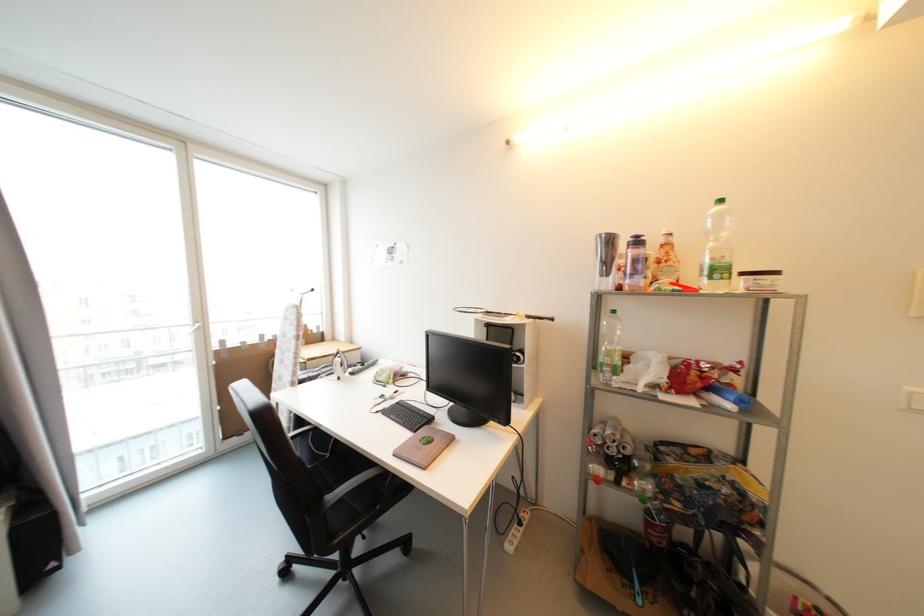
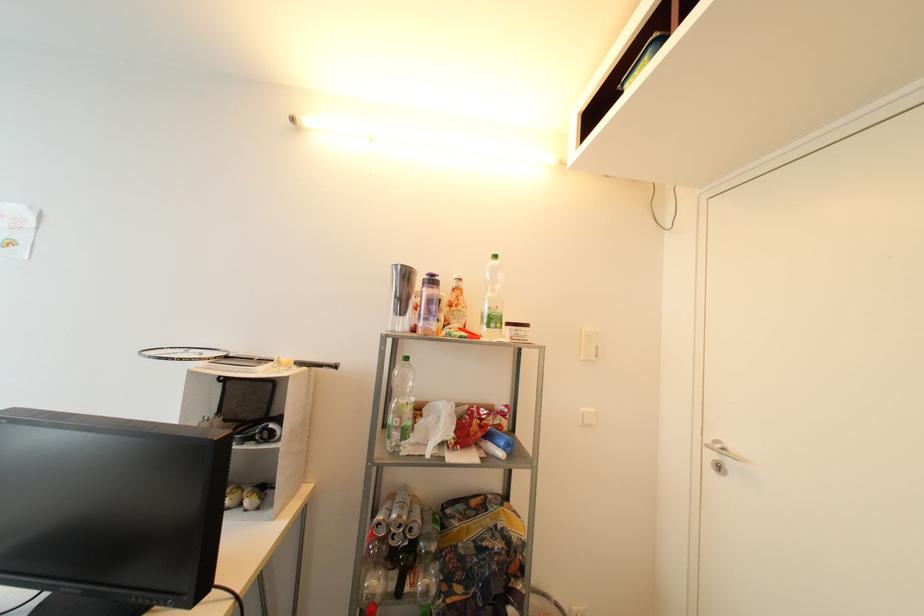
Question: I am providing you with two images of the same scene from different viewpoints. After the viewpoint changes to image2, which objects are now occluded?

Choices:
 (A) purple water bottle
 (B) orange label bottle
 (C) aluminum can
 (D) none of these

Answer: (D)